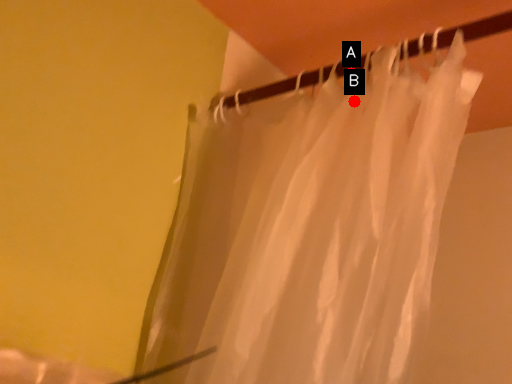
Question: Two points are circled on the image, labeled by A and B beside each circle. Which point appears closest to the camera in this image?

Choices:
 (A) A is closer
 (B) B is closer

Answer: (B)